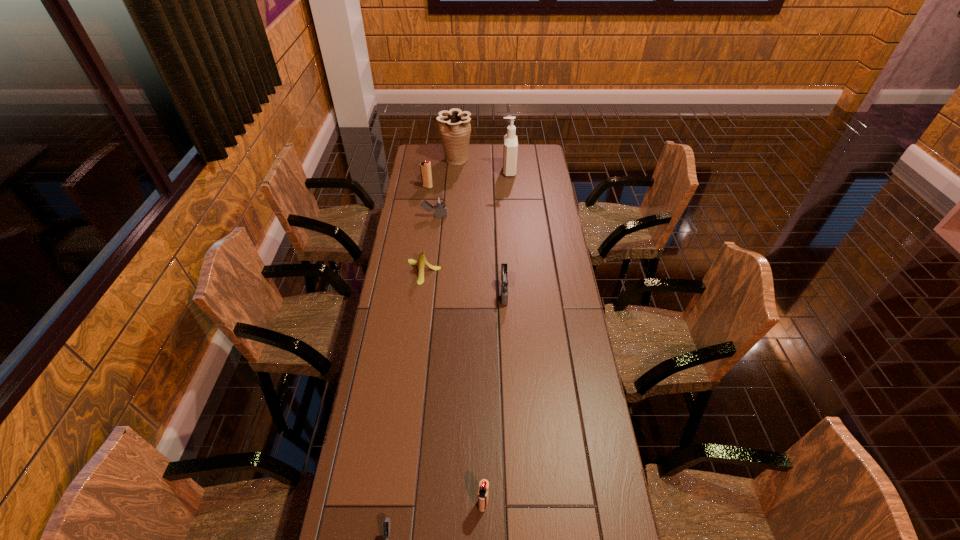
I want to click on free point between the cleansing agent and the urn, so [482, 165].

The image size is (960, 540). What are the coordinates of `empty space that is in between the tallest object and the banana` in the screenshot? It's located at (467, 221).

Identify the location of free spot between the third object from right to left and the banana. This screenshot has width=960, height=540. (454, 388).

You are a GUI agent. You are given a task and a screenshot of the screen. Output one action in this format:
    pyautogui.click(x=<x>, y=<y>)
    Task: Click on the free spot between the farther red igniter and the farthest gray igniter
    Image resolution: width=960 pixels, height=540 pixels.
    Given the screenshot: What is the action you would take?
    pyautogui.click(x=431, y=201)

In order to click on vacant area that lies between the second igniter from right to left and the second farthest gray igniter in this screenshot , I will do `click(493, 398)`.

Identify which object is located as the third nearest to the banana. Please provide its 2D coordinates. Your answer should be formatted as a tuple, i.e. [(x, y)], where the tuple contains the x and y coordinates of a point satisfying the conditions above.

[(425, 167)]

Identify which object is located as the seventh nearest to the tallest object. Please provide its 2D coordinates. Your answer should be formatted as a tuple, i.e. [(x, y)], where the tuple contains the x and y coordinates of a point satisfying the conditions above.

[(386, 523)]

Identify which igniter is located as the fourth nearest to the third farthest igniter. Please provide its 2D coordinates. Your answer should be formatted as a tuple, i.e. [(x, y)], where the tuple contains the x and y coordinates of a point satisfying the conditions above.

[(386, 523)]

At what (x,y) coordinates should I click in order to perform the action: click on igniter that is the fourth closest to the shortest object. Please return your answer as a coordinate pair (x, y). This screenshot has height=540, width=960. Looking at the image, I should click on (425, 167).

Select which red igniter appears as the closest to the urn. Please provide its 2D coordinates. Your answer should be formatted as a tuple, i.e. [(x, y)], where the tuple contains the x and y coordinates of a point satisfying the conditions above.

[(425, 167)]